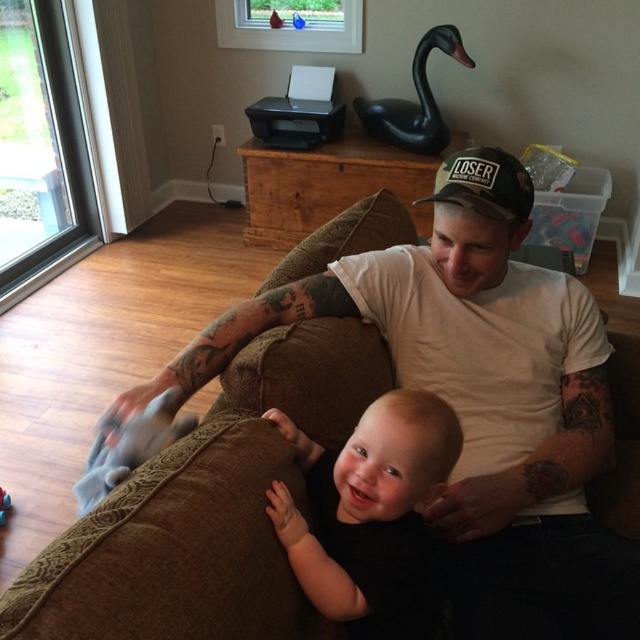
Question: Does white t-shirt at center have a larger size compared to black matte baby at center?

Choices:
 (A) yes
 (B) no

Answer: (A)

Question: Can you confirm if black matte baby at center is positioned to the right of black fabric baseball cap at center?

Choices:
 (A) yes
 (B) no

Answer: (B)

Question: Considering the real-world distances, which object is farthest from the rubber duck at lower left?

Choices:
 (A) black fabric baseball cap at center
 (B) white t-shirt at center

Answer: (A)

Question: Which point is closer to the camera taking this photo?

Choices:
 (A) (4, 508)
 (B) (538, 388)
 (C) (522, 196)

Answer: (C)

Question: Is black matte baby at center smaller than black fabric baseball cap at center?

Choices:
 (A) yes
 (B) no

Answer: (B)

Question: Which point is farther to the camera?

Choices:
 (A) black fabric baseball cap at center
 (B) rubber duck at lower left
 (C) white t-shirt at center

Answer: (B)